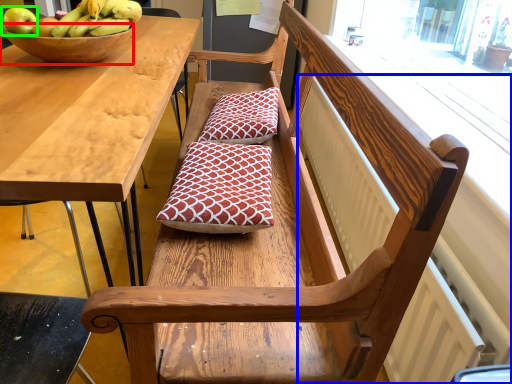
Question: Considering the real-world distances, which object is farthest from bowl (highlighted by a red box)? radiator (highlighted by a blue box) or apple (highlighted by a green box)?

Choices:
 (A) radiator
 (B) apple

Answer: (A)